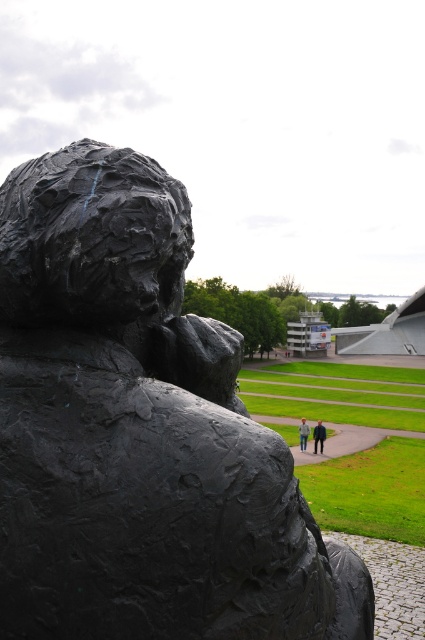
Locate an element on the screen. This screenshot has height=640, width=425. black matte sculpture at center is located at coordinates (139, 433).

Between black matte sculpture at center and blue jeans at center, which one is positioned higher?

black matte sculpture at center is higher up.

Who is more distant from viewer, (312, 593) or (320, 451)?

The point (320, 451) is more distant.

This screenshot has width=425, height=640. I want to click on black matte sculpture at center, so click(x=139, y=433).

Is blue jeans at center thinner than light blue jeans at center?

No.

Who is more forward, (323, 428) or (300, 445)?

Point (300, 445) is more forward.

This screenshot has height=640, width=425. Describe the element at coordinates (319, 436) in the screenshot. I see `blue jeans at center` at that location.

What are the coordinates of `blue jeans at center` in the screenshot? It's located at (319, 436).

This screenshot has width=425, height=640. I want to click on black matte sculpture at center, so click(139, 433).

The height and width of the screenshot is (640, 425). What do you see at coordinates (139, 433) in the screenshot? I see `black matte sculpture at center` at bounding box center [139, 433].

This screenshot has height=640, width=425. What do you see at coordinates (139, 433) in the screenshot?
I see `black matte sculpture at center` at bounding box center [139, 433].

You are a GUI agent. You are given a task and a screenshot of the screen. Output one action in this format:
    pyautogui.click(x=<x>, y=<y>)
    Task: Click on the black matte sculpture at center
    
    Given the screenshot: What is the action you would take?
    pyautogui.click(x=139, y=433)